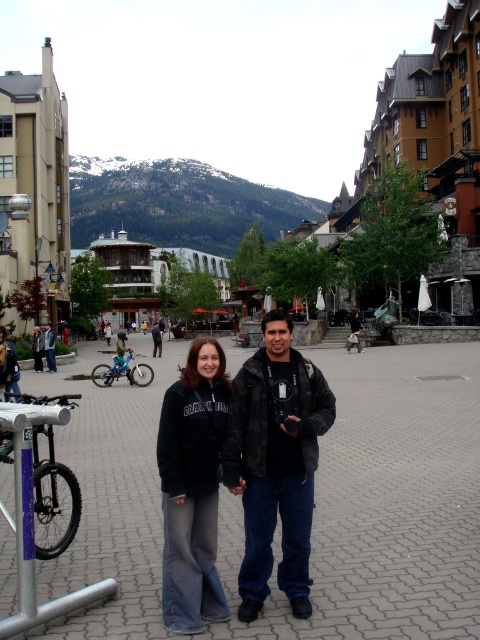
Question: Which point is closer to the camera?

Choices:
 (A) (156, 324)
 (B) (259, 451)

Answer: (B)

Question: Is blue metallic bicycle at lower left thinner than dark gray jacket at center?

Choices:
 (A) yes
 (B) no

Answer: (A)

Question: Is black matte jacket at center positioned in front of matte black bicycle at lower left?

Choices:
 (A) no
 (B) yes

Answer: (A)

Question: Which object appears closest to the camera in this image?

Choices:
 (A) matte black bicycle at lower left
 (B) dark gray jacket at center
 (C) blue metallic bicycle at lower left

Answer: (A)

Question: Which object is closer to the camera taking this photo?

Choices:
 (A) blue metallic bicycle at lower left
 (B) black leather jacket at center
 (C) black matte jacket at center

Answer: (C)

Question: Does blue metallic bicycle at lower left appear under dark gray jacket at center?

Choices:
 (A) no
 (B) yes

Answer: (B)